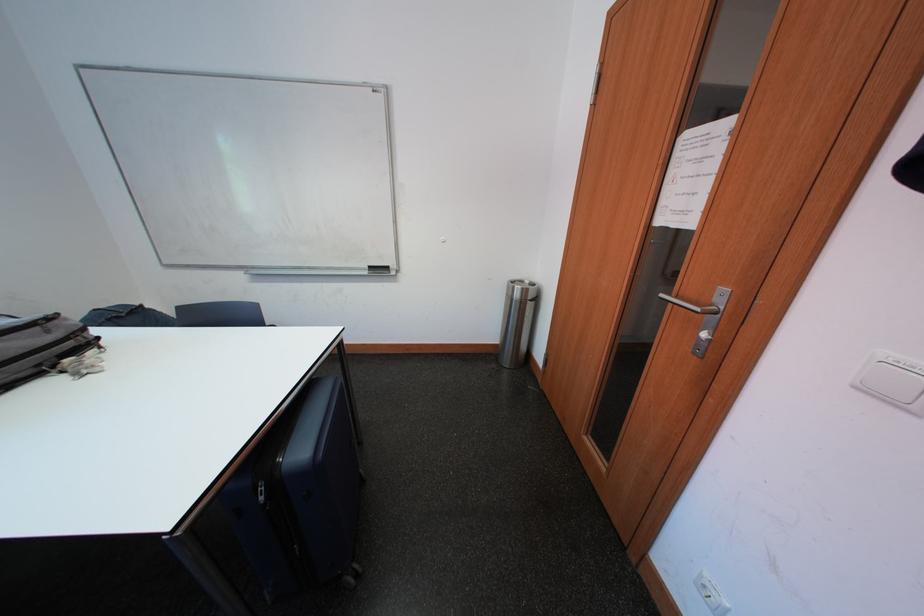
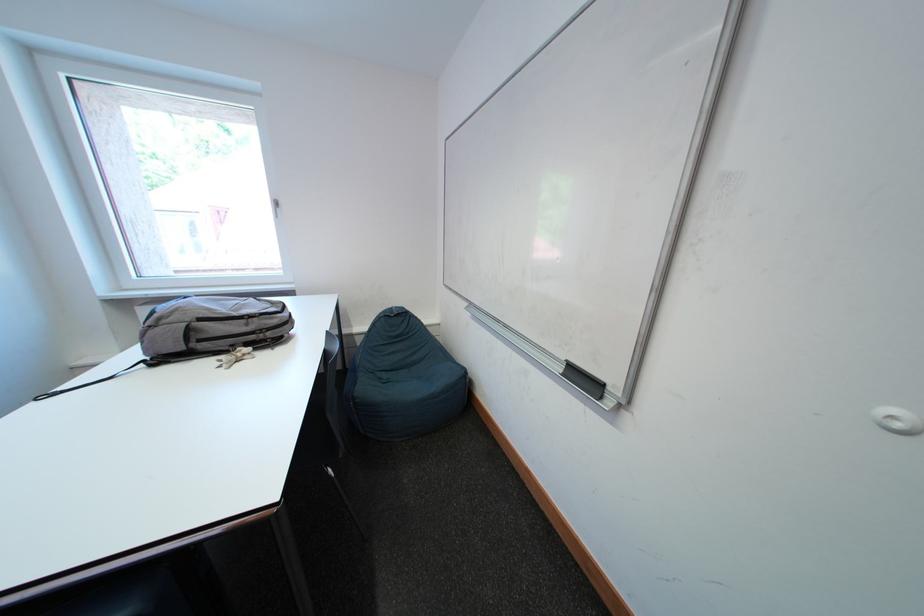
Question: I am providing you with two images of the same scene from different viewpoints. After the viewpoint changes to image2, which objects are now occluded?

Choices:
 (A) window handle
 (B) black whiteboard eraser
 (C) backpack zipper pull
 (D) none of these

Answer: (D)